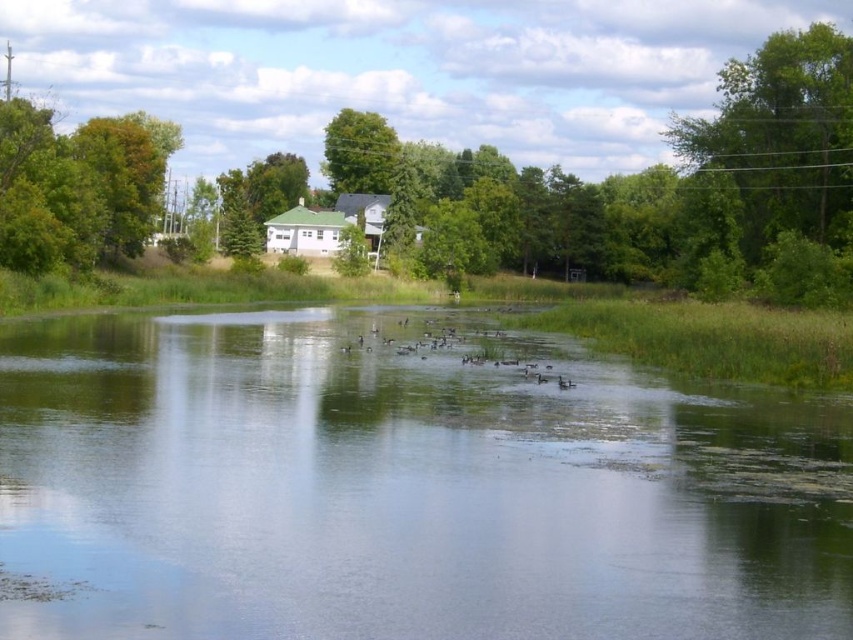
You are standing in the serene natural scene and want to walk from the green leafy tree at upper left to the green leafy tree at center. Which direction should you head to reach the destination?

To reach the green leafy tree at center from the green leafy tree at upper left, you should head to the right since the green leafy tree at upper left is positioned to the left of the green leafy tree at center.

Looking at this image, you are standing at the edge of the water and want to walk to the white house. There are two green leafy trees in your path. The first is the green leafy tree at upper left, and the second is the green leafy tree at center. Which tree is closer to you as you start your journey towards the house?

The green leafy tree at upper left is closer to you since it is only 158.59 feet away from the green leafy tree at center, meaning it is positioned in front of the latter along your path toward the house.